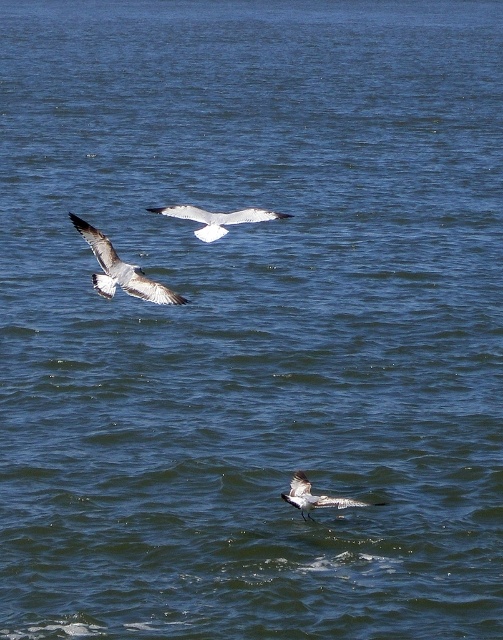
Question: Which point appears closest to the camera in this image?

Choices:
 (A) (143, 282)
 (B) (304, 502)

Answer: (B)

Question: Is white matte bird at center below speckled feathered bird at lower center?

Choices:
 (A) yes
 (B) no

Answer: (B)

Question: Does speckled feathered seagull at upper left have a greater width compared to speckled feathered bird at lower center?

Choices:
 (A) no
 (B) yes

Answer: (B)

Question: Is speckled feathered seagull at upper left smaller than speckled feathered bird at lower center?

Choices:
 (A) no
 (B) yes

Answer: (A)

Question: Which point is closer to the camera?

Choices:
 (A) speckled feathered bird at lower center
 (B) speckled feathered seagull at upper left

Answer: (A)

Question: Considering the real-world distances, which object is farthest from the speckled feathered bird at lower center?

Choices:
 (A) speckled feathered seagull at upper left
 (B) white matte bird at center

Answer: (B)